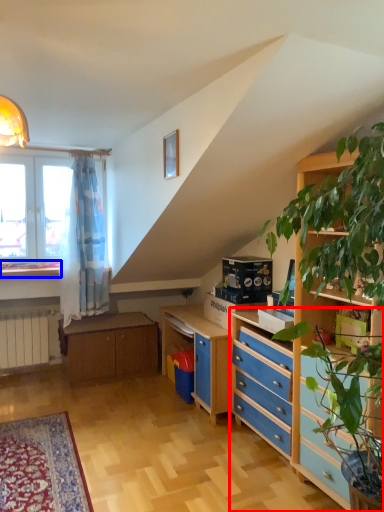
Question: Which of the following is the closest to the observer, chest of drawers (highlighted by a red box) or window sill (highlighted by a blue box)?

Choices:
 (A) chest of drawers
 (B) window sill

Answer: (A)